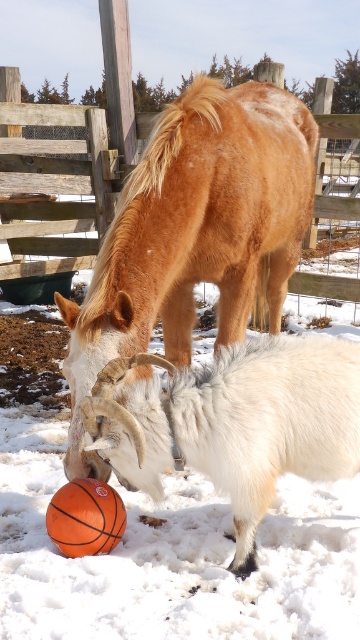
You are a photographer trying to capture the white woolen goat at lower center and the orange rubber basketball at lower center in the same frame. Based on their positions, which object should you focus on first to ensure both are in focus?

The white woolen goat at lower center is located above the orange rubber basketball at lower center, so you should focus on the white woolen goat at lower center first to ensure both are in focus.

You are an animal caretaker in the snowy field. You need to guide the white woolen goat at lower center to the wooden fence at upper center. Which direction should you move the goat to reach the fence?

The white woolen goat at lower center is to the right of the wooden fence at upper center, so you should move the goat to the left to reach the fence.

Looking at this image, you are a delivery robot with a 20 inch wide package. You need to move between the white woolen goat at lower center and the orange rubber basketball at lower center. Can you fit through the space between them?

The white woolen goat at lower center and orange rubber basketball at lower center are 18.51 inches apart from each other. Since the package is 20 inches wide, it is wider than the available space. Therefore, the robot cannot fit through the space between them.